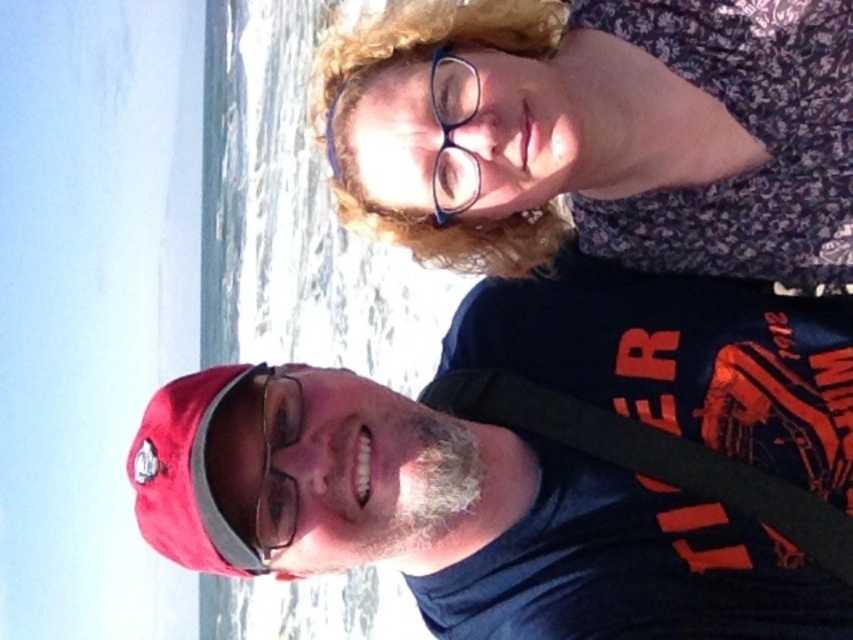
You are taking a photo of the red cap at lower left and the blue plastic glasses at upper center. Which object will appear larger in the photo?

The red cap at lower left will appear larger in the photo because it is closer to the viewer than the blue plastic glasses at upper center.

You are a photographer trying to capture a closeup of the clear plastic glasses at center. You notice the floral fabric dress at upper right is blocking your view. Can you estimate if you can move the dress to the side without overlapping the glasses?

The floral fabric dress at upper right is wider than the clear plastic glasses at center, so moving it might require more space to avoid overlapping.

Based on the photo, you are standing at the point labeled as point (837, 161) and want to take a photo of the two people in the scene. Since you are 17.65 feet away from the viewer, will you be able to fit both individuals into the frame of a standard camera with a 50mm lens?

Since the point (837, 161) is 17.65 feet away from the viewer, and a standard 50mm lens has a field of view that can typically capture subjects within about 15 feet comfortably, you might need to step back slightly or use a wider lens to ensure both individuals are fully in the frame.